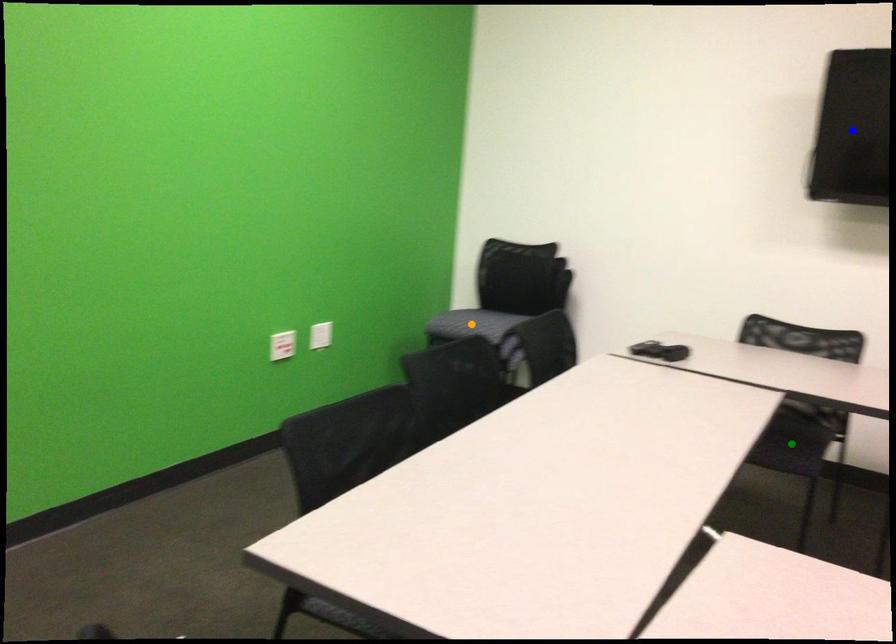
Order these from nearest to farthest:
- green point
- blue point
- orange point

green point
blue point
orange point